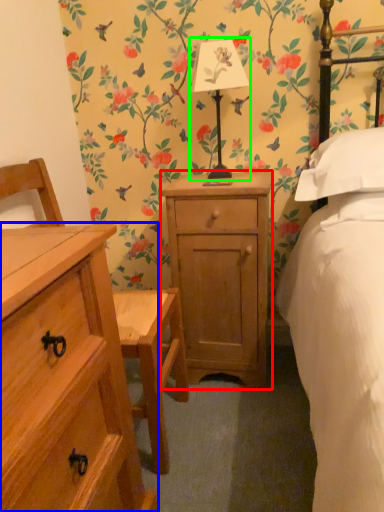
Question: Based on their relative distances, which object is farther from nightstand (highlighted by a red box)? Choose from chest of drawers (highlighted by a blue box) and bedside lamp (highlighted by a green box).

Choices:
 (A) chest of drawers
 (B) bedside lamp

Answer: (A)